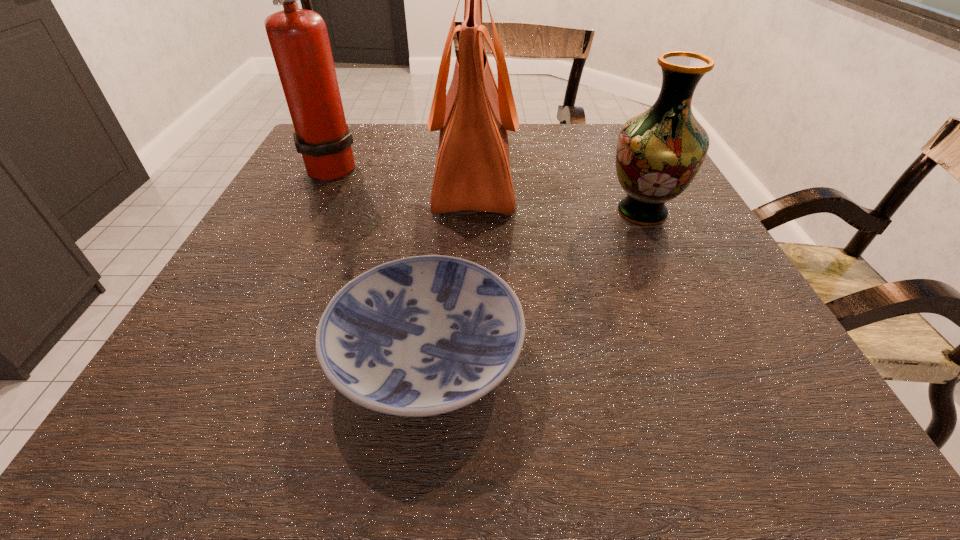
This screenshot has width=960, height=540. What are the coordinates of `the leftmost object` in the screenshot? It's located at tap(298, 38).

You are a GUI agent. You are given a task and a screenshot of the screen. Output one action in this format:
    pyautogui.click(x=<x>, y=<y>)
    Task: Click on the tallest object
    Image resolution: width=960 pixels, height=540 pixels.
    Given the screenshot: What is the action you would take?
    pyautogui.click(x=298, y=38)

The height and width of the screenshot is (540, 960). In order to click on shopping bag in this screenshot , I will do `click(472, 172)`.

Find the location of a particular element. The width and height of the screenshot is (960, 540). vase is located at coordinates (659, 152).

This screenshot has height=540, width=960. Find the location of `plate`. plate is located at coordinates (425, 335).

This screenshot has height=540, width=960. What are the coordinates of `the nearest object` in the screenshot? It's located at (425, 335).

Find the location of `free space located 0.380m at the nozzle of the leftmost object`. free space located 0.380m at the nozzle of the leftmost object is located at coordinates (519, 165).

This screenshot has width=960, height=540. Identify the location of vacant space located on the front pocket of the shopping bag. (608, 174).

This screenshot has height=540, width=960. I want to click on free location located on the back of the rightmost object, so click(604, 130).

At what (x,y) coordinates should I click in order to perform the action: click on free space located on the back of the nearest object. Please return your answer as a coordinate pair (x, y). The width and height of the screenshot is (960, 540). Looking at the image, I should click on (438, 249).